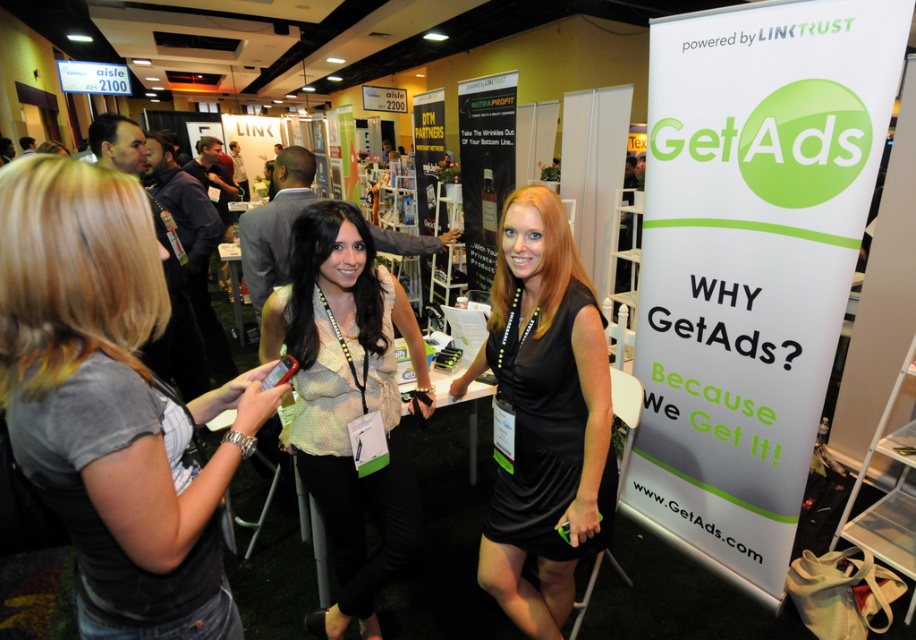
Question: Is gray fabric shirt at left smaller than black satin dress at center?

Choices:
 (A) yes
 (B) no

Answer: (A)

Question: Based on their relative distances, which object is farther from the gray fabric shirt at left?

Choices:
 (A) white paper banner at right
 (B) black satin dress at center
 (C) light beige sheer blouse at center

Answer: (A)

Question: Which is nearer to the black satin dress at center?

Choices:
 (A) gray fabric shirt at left
 (B) white paper banner at right
 (C) light beige sheer blouse at center

Answer: (C)

Question: Is the position of white paper banner at right less distant than that of gray fabric shirt at left?

Choices:
 (A) yes
 (B) no

Answer: (B)

Question: Does gray fabric shirt at left have a greater width compared to black satin dress at center?

Choices:
 (A) yes
 (B) no

Answer: (B)

Question: Among these points, which one is nearest to the camera?

Choices:
 (A) (365, 336)
 (B) (530, 228)
 (C) (860, 76)
 (D) (35, 420)

Answer: (D)